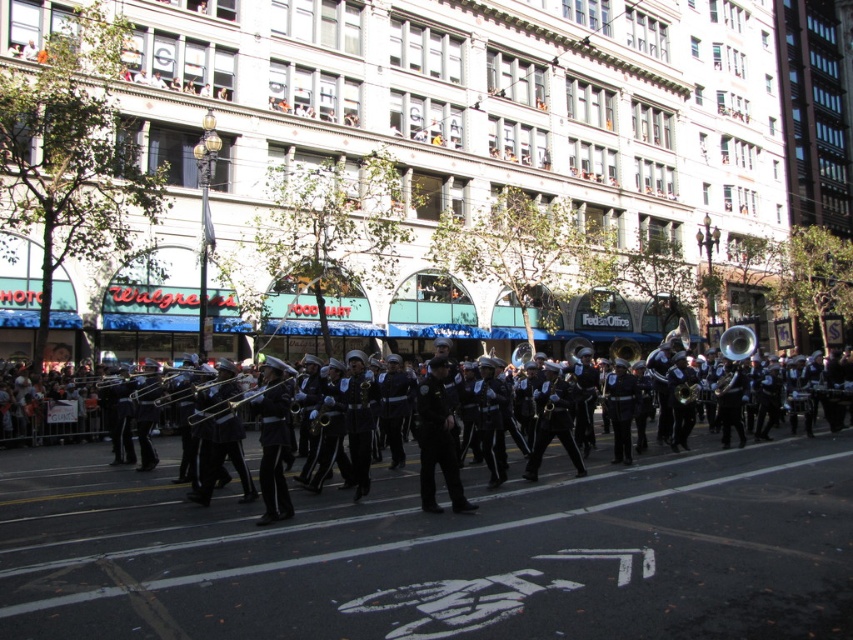
Question: Which point is farther to the camera?

Choices:
 (A) (732, 346)
 (B) (167, 465)
 (C) (450, 454)
 (D) (181, 380)

Answer: (A)

Question: Is shiny brass trombone at center below shiny brass trumpet at center?

Choices:
 (A) yes
 (B) no

Answer: (B)

Question: Does shiny brass trombone at center come behind brass shiny tuba at right?

Choices:
 (A) yes
 (B) no

Answer: (B)

Question: Which object is closer to the camera taking this photo?

Choices:
 (A) dark blue uniform at center
 (B) shiny silver trombone at center

Answer: (B)

Question: Among these points, which one is nearest to the camera?

Choices:
 (A) (33, 468)
 (B) (155, 404)
 (C) (183, 397)
 (D) (421, 468)

Answer: (D)

Question: Does shiny brass trumpet at center have a smaller size compared to shiny silver trombone at center?

Choices:
 (A) yes
 (B) no

Answer: (A)